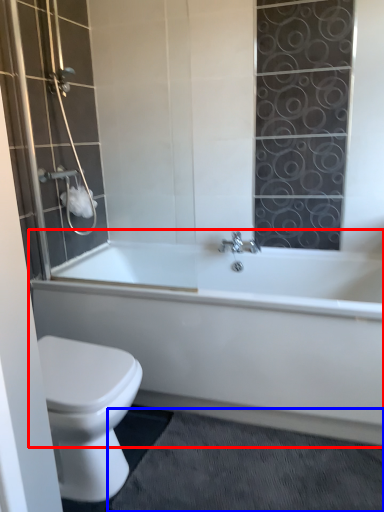
Question: Which point is closer to the camera, bathtub (highlighted by a red box) or bath mat (highlighted by a blue box)?

Choices:
 (A) bathtub
 (B) bath mat

Answer: (B)